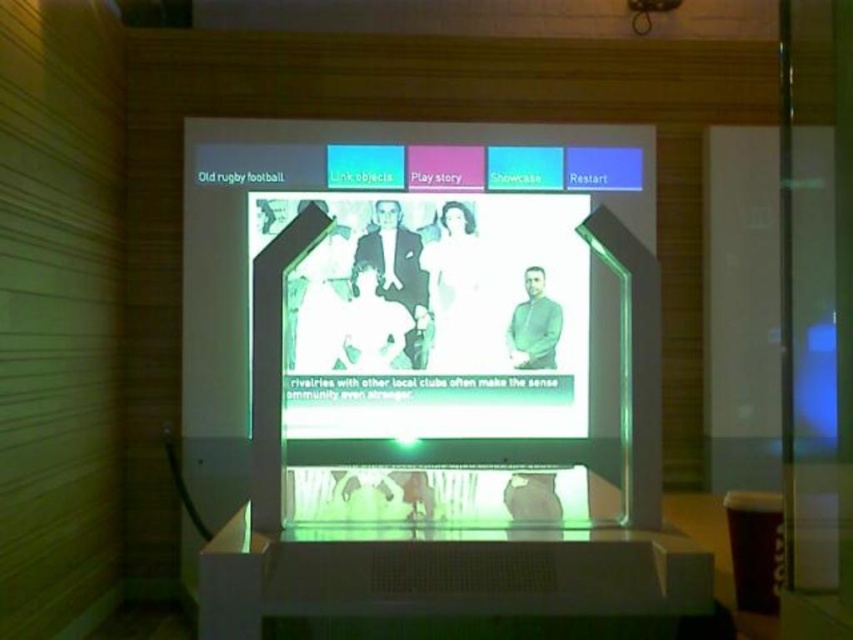
Question: Among these objects, which one is nearest to the camera?

Choices:
 (A) transparent plastic projector at center
 (B) translucent plastic screen at center

Answer: (B)

Question: Which object is closer to the camera taking this photo?

Choices:
 (A) translucent plastic screen at center
 (B) transparent plastic projector at center

Answer: (A)

Question: Considering the relative positions of translucent plastic screen at center and transparent plastic projector at center in the image provided, where is translucent plastic screen at center located with respect to transparent plastic projector at center?

Choices:
 (A) left
 (B) right

Answer: (A)

Question: Where is translucent plastic screen at center located in relation to transparent plastic projector at center in the image?

Choices:
 (A) right
 (B) left

Answer: (B)

Question: Which of the following is the farthest from the observer?

Choices:
 (A) (640, 4)
 (B) (349, 342)

Answer: (A)

Question: Does translucent plastic screen at center have a larger size compared to transparent plastic projector at center?

Choices:
 (A) yes
 (B) no

Answer: (A)